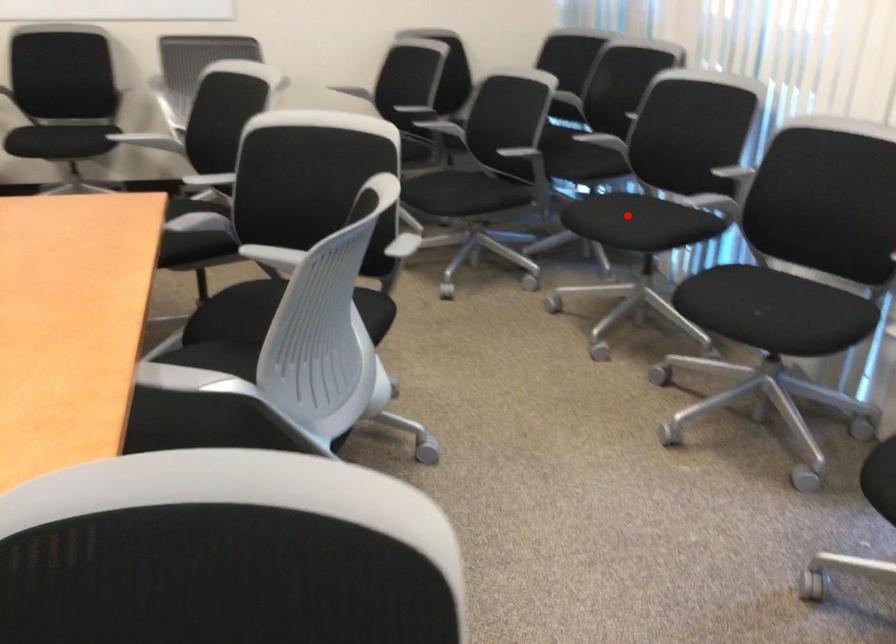
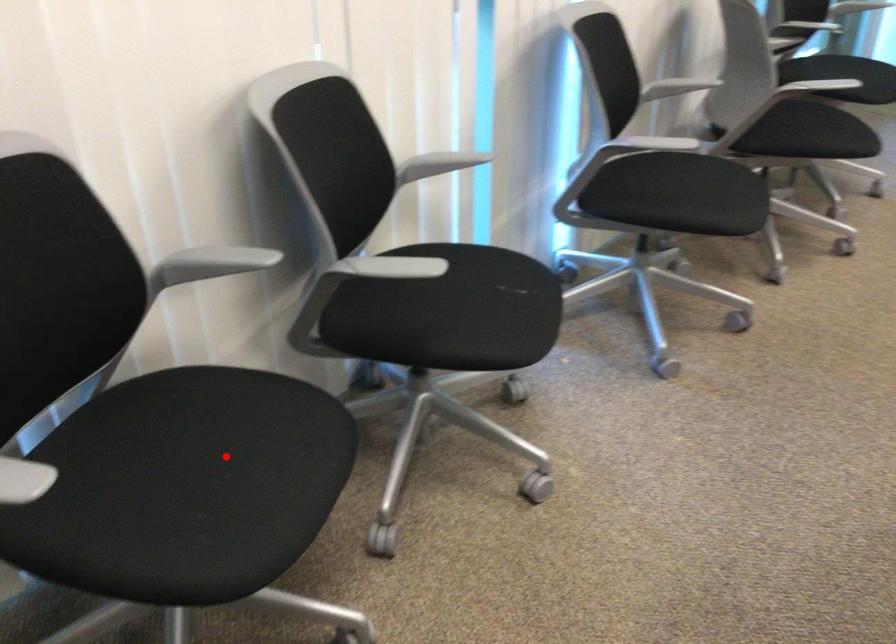
I am providing you with two images of the same scene from different viewpoints. A red point is marked on the first image and another point is marked on the second image. Do the highlighted points in image1 and image2 indicate the same real-world spot?

Yes